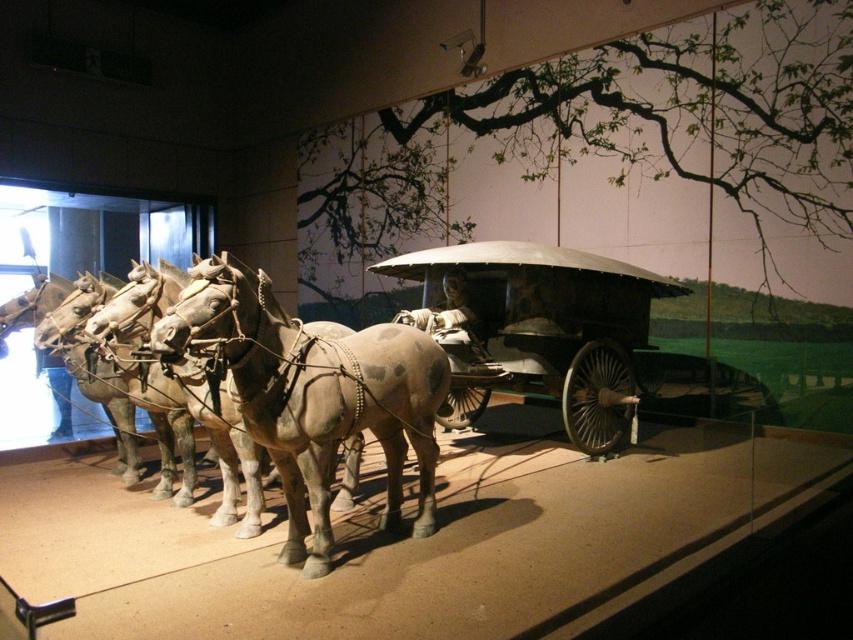
You are a museum visitor observing the chariot exhibit. You notice the brown matte horse at center and the polished wood wagon at center. Which object is shorter in height?

The brown matte horse at center has a lesser height compared to the polished wood wagon at center, so the brown matte horse at center is shorter.

In the scene shown: You are a visitor standing in front of the museum exhibit. You notice the brown matte horse at center and the polished wood wagon at center. Which object is positioned closer to you?

The brown matte horse at center is closer to the viewer than the polished wood wagon at center.